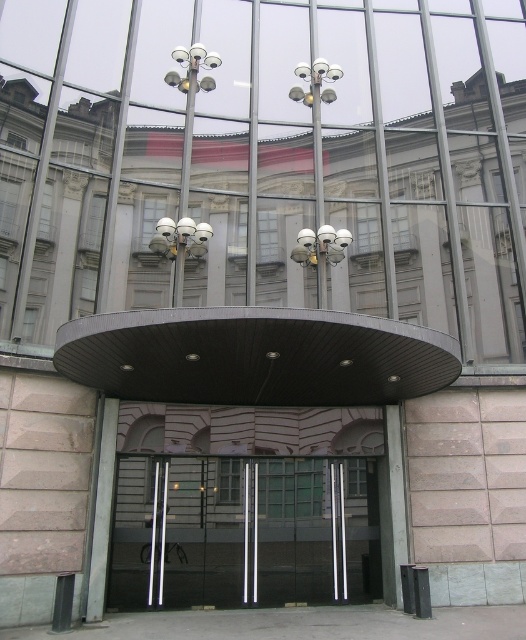
Between transparent glass door at center and metallic dome at center, which one has more height?

transparent glass door at center

Describe the element at coordinates (242, 532) in the screenshot. I see `transparent glass door at center` at that location.

This screenshot has height=640, width=526. I want to click on transparent glass door at center, so click(x=242, y=532).

Where is `sleek metallic security cameras at center`? The image size is (526, 640). sleek metallic security cameras at center is located at coordinates click(179, 237).

Who is taller, sleek metallic security cameras at center or metallic dome at center?

metallic dome at center is taller.

Does point (160, 253) come farther from viewer compared to point (311, 93)?

No, it is not.

Where is `sleek metallic security cameras at center`? sleek metallic security cameras at center is located at coordinates (179, 237).

Can you confirm if transparent glass door at center is positioned to the left of white plastic cameras at center?

Indeed, transparent glass door at center is positioned on the left side of white plastic cameras at center.

Can you confirm if transparent glass door at center is bigger than white plastic cameras at center?

Indeed, transparent glass door at center has a larger size compared to white plastic cameras at center.

Locate an element on the screen. The width and height of the screenshot is (526, 640). transparent glass door at center is located at coordinates (242, 532).